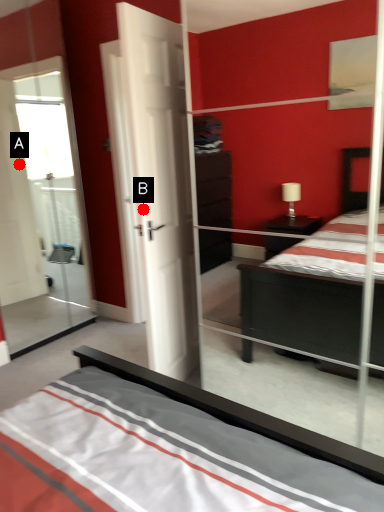
Question: Two points are circled on the image, labeled by A and B beside each circle. Which point is farther to the camera?

Choices:
 (A) A is further
 (B) B is further

Answer: (A)